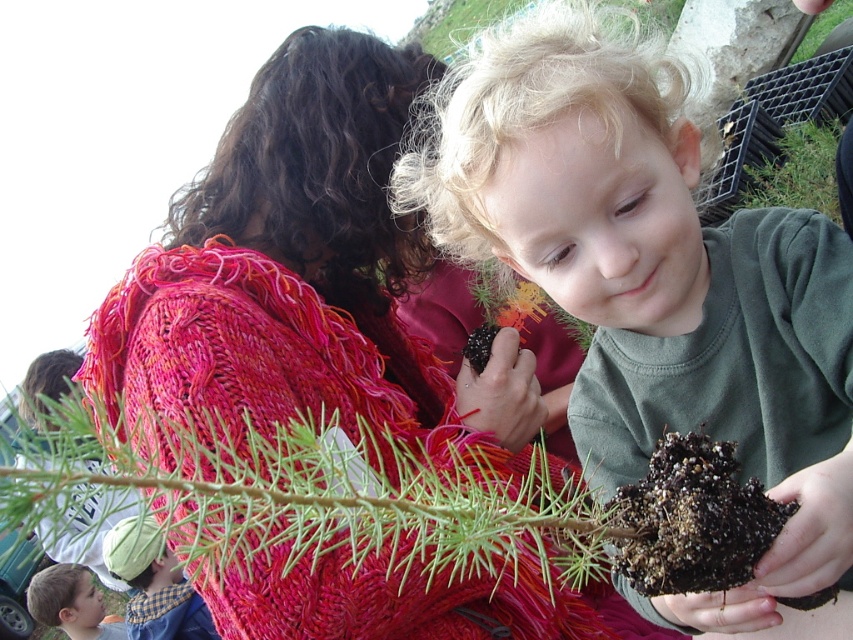
Question: Is matte green shirt at center bigger than dark green soil at upper right?

Choices:
 (A) yes
 (B) no

Answer: (A)

Question: Which is farther from the matte green shirt at center?

Choices:
 (A) dark green soil at upper right
 (B) knitted wool scarf at upper center

Answer: (A)

Question: Is checkered fabric shirt at lower left positioned in front of smooth blackberry at center?

Choices:
 (A) no
 (B) yes

Answer: (A)

Question: Which point is closer to the camera?

Choices:
 (A) (757, 563)
 (B) (517, 342)

Answer: (A)

Question: Which of the following is the farthest from the observer?

Choices:
 (A) brown fuzzy plant at upper center
 (B) knitted wool scarf at upper center
 (C) smooth blackberry at center
 (D) smooth skin face at lower left

Answer: (A)

Question: Can you confirm if dark brown soil at lower right is positioned above smooth skin face at lower left?

Choices:
 (A) no
 (B) yes

Answer: (B)